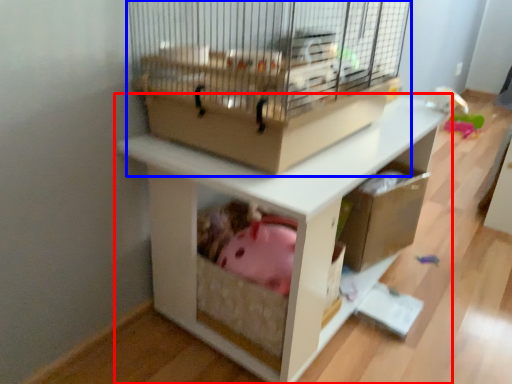
Question: Which of the following is the farthest to the observer, shelf (highlighted by a red box) or bird cage (highlighted by a blue box)?

Choices:
 (A) shelf
 (B) bird cage

Answer: (A)